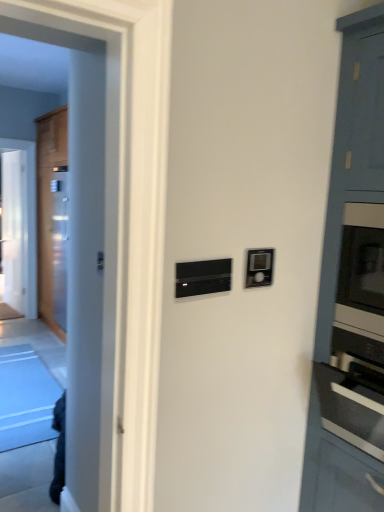
Question: From the image's perspective, is transparent glass door at left located beneath black matte thermostat at center?

Choices:
 (A) no
 (B) yes

Answer: (A)

Question: Is transparent glass door at left directly adjacent to black matte thermostat at center?

Choices:
 (A) yes
 (B) no

Answer: (B)

Question: Considering the relative sizes of transparent glass door at left and black matte thermostat at center in the image provided, is transparent glass door at left smaller than black matte thermostat at center?

Choices:
 (A) no
 (B) yes

Answer: (A)

Question: Could black matte thermostat at center be considered to be inside transparent glass door at left?

Choices:
 (A) yes
 (B) no

Answer: (B)

Question: From the image's perspective, is transparent glass door at left over black matte thermostat at center?

Choices:
 (A) yes
 (B) no

Answer: (A)

Question: Is point (345, 505) positioned closer to the camera than point (11, 264)?

Choices:
 (A) farther
 (B) closer

Answer: (B)

Question: Is satin silver oven at right wider or thinner than transparent glass door at left?

Choices:
 (A) thin
 (B) wide

Answer: (B)

Question: Considering the relative positions of satin silver oven at right and transparent glass door at left in the image provided, is satin silver oven at right to the left or to the right of transparent glass door at left?

Choices:
 (A) left
 (B) right

Answer: (B)

Question: Is satin silver oven at right situated inside transparent glass door at left or outside?

Choices:
 (A) outside
 (B) inside

Answer: (A)

Question: Looking at their shapes, would you say black matte thermostat at center is wider or thinner than wooden door at left?

Choices:
 (A) wide
 (B) thin

Answer: (B)

Question: Considering the positions of black matte thermostat at center and wooden door at left in the image, is black matte thermostat at center bigger or smaller than wooden door at left?

Choices:
 (A) big
 (B) small

Answer: (B)

Question: Is black matte thermostat at center taller or shorter than wooden door at left?

Choices:
 (A) short
 (B) tall

Answer: (A)

Question: Considering the positions of point (188, 295) and point (57, 325), is point (188, 295) closer or farther from the camera than point (57, 325)?

Choices:
 (A) closer
 (B) farther

Answer: (A)

Question: Does point (221, 283) appear closer or farther from the camera than point (13, 197)?

Choices:
 (A) farther
 (B) closer

Answer: (B)

Question: From the image's perspective, is black matte thermostat at center located above or below transparent glass door at left?

Choices:
 (A) below
 (B) above

Answer: (A)